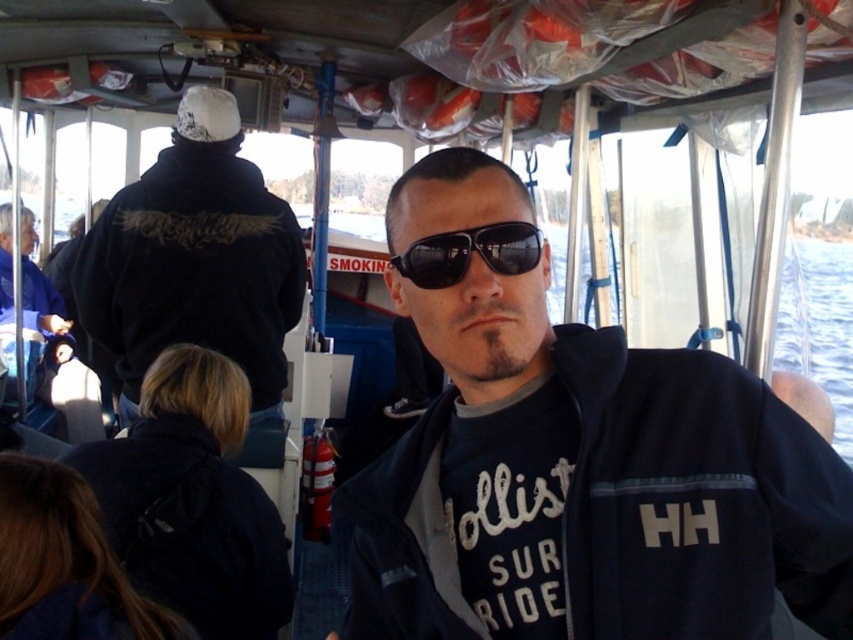
You are on a boat and want to take a photo of two points marked in the image. The first point is at coordinate point (457,548) and the second point is at coordinate point (128,413). Which point is closer to the camera?

Point (457,548) is closer to the camera than point (128,413).

You are navigating a boat and need to determine the relative positions of two points on the boat deck. Given that point A is at coordinates point [177,252] and point B is at point [519,227], which point is closer to the front of the boat?

Point B at point [519,227] is closer to the front of the boat because point A at point [177,252] is behind it.